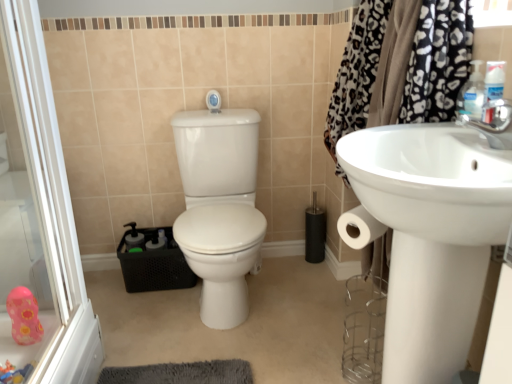
Question: Is white glossy toilet at center facing towards plastic pink toy at lower left, placed as the first toy when sorted from bottom to top?

Choices:
 (A) yes
 (B) no

Answer: (B)

Question: Considering the relative sizes of white glossy toilet at center and plastic pink toy at lower left, which is the 1th toy from front to back, in the image provided, is white glossy toilet at center taller than plastic pink toy at lower left, which is the 1th toy from front to back,?

Choices:
 (A) no
 (B) yes

Answer: (B)

Question: Does white glossy toilet at center have a lesser width compared to plastic pink toy at lower left, which is the 2th toy in back-to-front order?

Choices:
 (A) no
 (B) yes

Answer: (A)

Question: Is white glossy toilet at center to the left of plastic pink toy at lower left, placed as the first toy when sorted from bottom to top, from the viewer's perspective?

Choices:
 (A) no
 (B) yes

Answer: (A)

Question: From a real-world perspective, is white glossy toilet at center physically above plastic pink toy at lower left, placed as the first toy when sorted from bottom to top?

Choices:
 (A) no
 (B) yes

Answer: (B)

Question: Is white glossy toilet at center outside of plastic pink toy at lower left, placed as the first toy when sorted from bottom to top?

Choices:
 (A) no
 (B) yes

Answer: (B)

Question: From the image's perspective, is white glossy sink at right located above white glossy shower at upper center?

Choices:
 (A) no
 (B) yes

Answer: (A)

Question: Would you say white glossy sink at right is outside white glossy shower at upper center?

Choices:
 (A) no
 (B) yes

Answer: (B)

Question: Is white glossy sink at right not near white glossy shower at upper center?

Choices:
 (A) yes
 (B) no

Answer: (A)

Question: Is white glossy shower at upper center at the back of white glossy sink at right?

Choices:
 (A) yes
 (B) no

Answer: (B)

Question: Does white glossy sink at right have a smaller size compared to white glossy shower at upper center?

Choices:
 (A) yes
 (B) no

Answer: (B)

Question: From the image's perspective, is white glossy sink at right under white glossy shower at upper center?

Choices:
 (A) yes
 (B) no

Answer: (A)

Question: Is pink rubber duck at lower left, marked as the second toy in a bottom-to-top arrangement, inside white glossy sink at right?

Choices:
 (A) yes
 (B) no

Answer: (B)